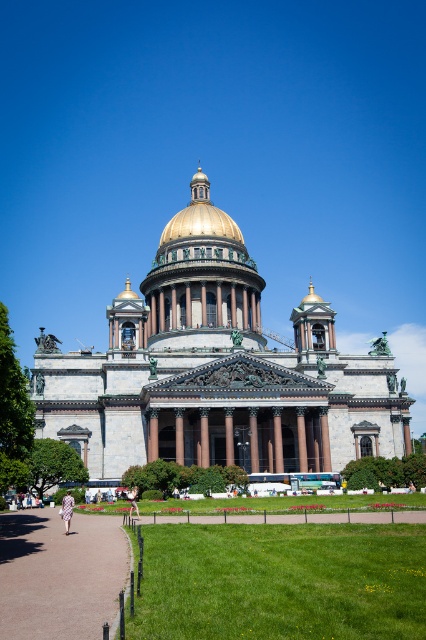
Question: Among these points, which one is farthest from the camera?

Choices:
 (A) (198, 182)
 (B) (138, 508)

Answer: (A)

Question: Can you confirm if golden dome church at center is smaller than plaid fabric dress at center?

Choices:
 (A) yes
 (B) no

Answer: (B)

Question: Where is golden dome church at center located in relation to gold polished dome at center in the image?

Choices:
 (A) right
 (B) left

Answer: (A)

Question: Estimate the real-world distances between objects in this image. Which object is closer to the golden dome church at center?

Choices:
 (A) plaid fabric dress at center
 (B) brown gravel path at lower left

Answer: (A)

Question: Considering the relative positions of gold polished dome at center and light brown leather jacket at center in the image provided, where is gold polished dome at center located with respect to light brown leather jacket at center?

Choices:
 (A) right
 (B) left

Answer: (A)

Question: Among these points, which one is nearest to the camera?

Choices:
 (A) (232, 221)
 (B) (20, 600)

Answer: (B)